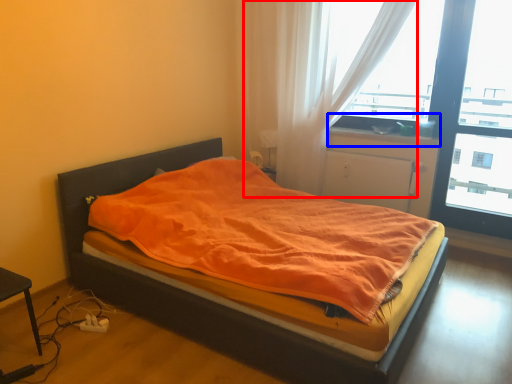
Question: Which of the following is the closest to the observer, curtain (highlighted by a red box) or window sill (highlighted by a blue box)?

Choices:
 (A) curtain
 (B) window sill

Answer: (A)